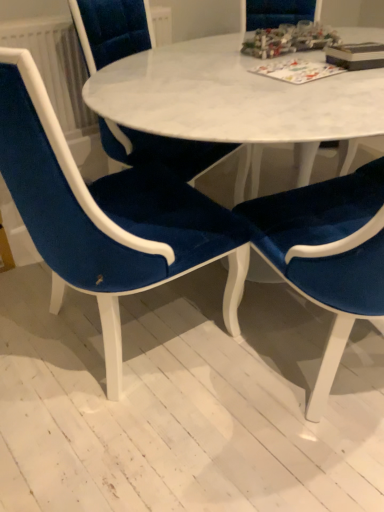
Identify the location of vacant space in velvet blue chair at lower left, which is the 1th chair from left to right (from a real-world perspective). (97, 353).